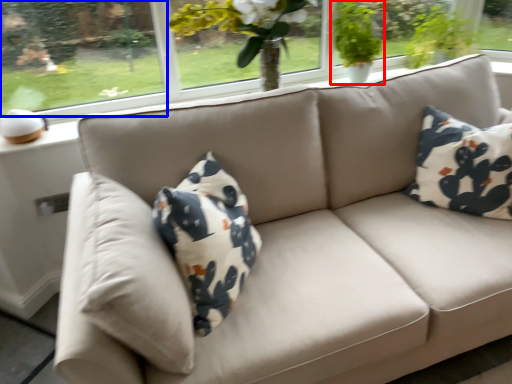
Question: Among these objects, which one is nearest to the camera, houseplant (highlighted by a red box) or window screen (highlighted by a blue box)?

Choices:
 (A) houseplant
 (B) window screen

Answer: (B)